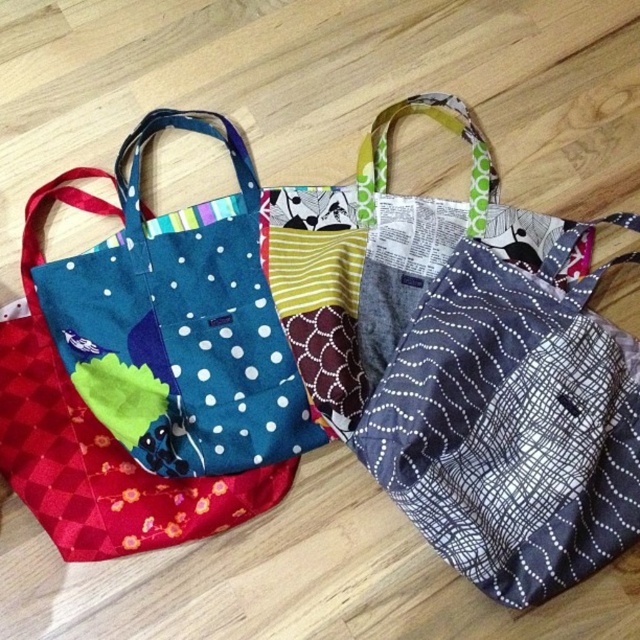
Question: From the image, what is the correct spatial relationship of blue fabric tote at left in relation to gray dotted fabric pocket at center?

Choices:
 (A) left
 (B) right

Answer: (A)

Question: Can you confirm if blue fabric tote at left is positioned to the left of gray dotted fabric pocket at center?

Choices:
 (A) yes
 (B) no

Answer: (A)

Question: Which object appears farthest from the camera in this image?

Choices:
 (A) blue fabric tote at left
 (B) gray dotted fabric pocket at center

Answer: (B)

Question: Is blue fabric tote at left wider than gray dotted fabric pocket at center?

Choices:
 (A) yes
 (B) no

Answer: (A)